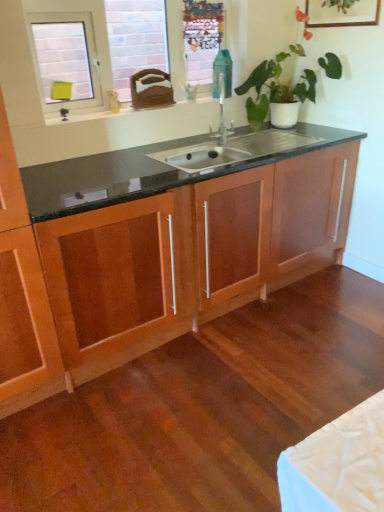
Question: From a real-world perspective, is metallic mesh at upper center below wooden picture frame at upper right?

Choices:
 (A) yes
 (B) no

Answer: (A)

Question: Is metallic mesh at upper center further to the viewer compared to wooden picture frame at upper right?

Choices:
 (A) yes
 (B) no

Answer: (A)

Question: Can you confirm if metallic mesh at upper center is wider than wooden picture frame at upper right?

Choices:
 (A) no
 (B) yes

Answer: (A)

Question: Is metallic mesh at upper center to the left of wooden picture frame at upper right from the viewer's perspective?

Choices:
 (A) yes
 (B) no

Answer: (A)

Question: From a real-world perspective, is metallic mesh at upper center physically above wooden picture frame at upper right?

Choices:
 (A) yes
 (B) no

Answer: (B)

Question: Is metallic mesh at upper center to the right of wooden picture frame at upper right from the viewer's perspective?

Choices:
 (A) no
 (B) yes

Answer: (A)

Question: Would you say green glossy plant at upper center is outside wooden cabinet at center?

Choices:
 (A) no
 (B) yes

Answer: (B)

Question: From the image's perspective, is green glossy plant at upper center located beneath wooden cabinet at center?

Choices:
 (A) yes
 (B) no

Answer: (B)

Question: Is green glossy plant at upper center far away from wooden cabinet at center?

Choices:
 (A) no
 (B) yes

Answer: (A)

Question: Is green glossy plant at upper center aimed at wooden cabinet at center?

Choices:
 (A) no
 (B) yes

Answer: (A)

Question: From the image's perspective, is green glossy plant at upper center on top of wooden cabinet at center?

Choices:
 (A) yes
 (B) no

Answer: (A)

Question: Is green glossy plant at upper center looking in the opposite direction of wooden cabinet at center?

Choices:
 (A) yes
 (B) no

Answer: (B)

Question: Is metallic mesh at upper center surrounding green glossy plant at upper center?

Choices:
 (A) no
 (B) yes

Answer: (A)